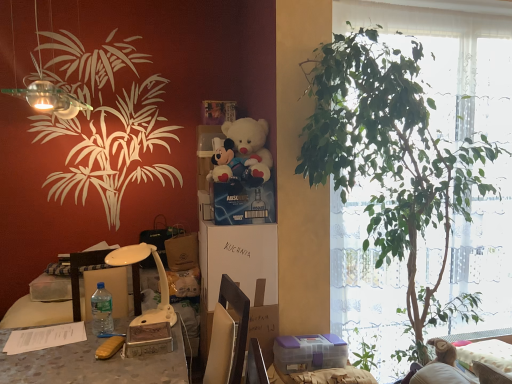
Question: Are wooden box at center, which is counted as the first box, starting from the front, and white plastic lamp at lower left, placed as the second lamp when sorted from top to bottom, beside each other?

Choices:
 (A) yes
 (B) no

Answer: (B)

Question: Could you tell me if wooden box at center, acting as the second box starting from the bottom, is facing white plastic lamp at lower left, marked as the 1th lamp in a back-to-front arrangement?

Choices:
 (A) no
 (B) yes

Answer: (A)

Question: From the image's perspective, is wooden box at center, the third box viewed from the right, located beneath white plastic lamp at lower left, the first lamp ordered from the bottom?

Choices:
 (A) no
 (B) yes

Answer: (B)

Question: Is white plastic lamp at lower left, the first lamp ordered from the bottom, located within wooden box at center, which is the 2th box from left to right?

Choices:
 (A) no
 (B) yes

Answer: (A)

Question: Can you confirm if wooden box at center, which is the 2th box from left to right, is positioned to the right of white plastic lamp at lower left, placed as the second lamp when sorted from top to bottom?

Choices:
 (A) no
 (B) yes

Answer: (B)

Question: Looking at their shapes, would you say clear plastic bottle at lower left is wider or thinner than velvet pink couch at lower right?

Choices:
 (A) thin
 (B) wide

Answer: (A)

Question: Considering their positions, is clear plastic bottle at lower left located in front of or behind velvet pink couch at lower right?

Choices:
 (A) front
 (B) behind

Answer: (A)

Question: Choose the correct answer: Is clear plastic bottle at lower left inside velvet pink couch at lower right or outside it?

Choices:
 (A) inside
 (B) outside

Answer: (B)

Question: From a real-world perspective, relative to velvet pink couch at lower right, is clear plastic bottle at lower left vertically above or below?

Choices:
 (A) below
 (B) above

Answer: (B)

Question: From the image's perspective, is wooden box at center, which is the 4th box from back to front, above or below cardboard box at center?

Choices:
 (A) below
 (B) above

Answer: (B)

Question: Considering the positions of wooden box at center, which appears as the third box when viewed from the top, and cardboard box at center in the image, is wooden box at center, which appears as the third box when viewed from the top, taller or shorter than cardboard box at center?

Choices:
 (A) tall
 (B) short

Answer: (B)

Question: Considering the positions of point (172, 340) and point (246, 327), is point (172, 340) closer or farther from the camera than point (246, 327)?

Choices:
 (A) closer
 (B) farther

Answer: (B)

Question: Looking at the image, does wooden box at center, which appears as the third box when viewed from the top, seem bigger or smaller compared to cardboard box at center?

Choices:
 (A) small
 (B) big

Answer: (A)

Question: Relative to brown paper bag at center, positioned as the first box in left-to-right order, is cardboard box at center in front or behind?

Choices:
 (A) front
 (B) behind

Answer: (A)

Question: Considering the positions of cardboard box at center and brown paper bag at center, the 4th box viewed from the right, in the image, is cardboard box at center wider or thinner than brown paper bag at center, the 4th box viewed from the right,?

Choices:
 (A) wide
 (B) thin

Answer: (A)